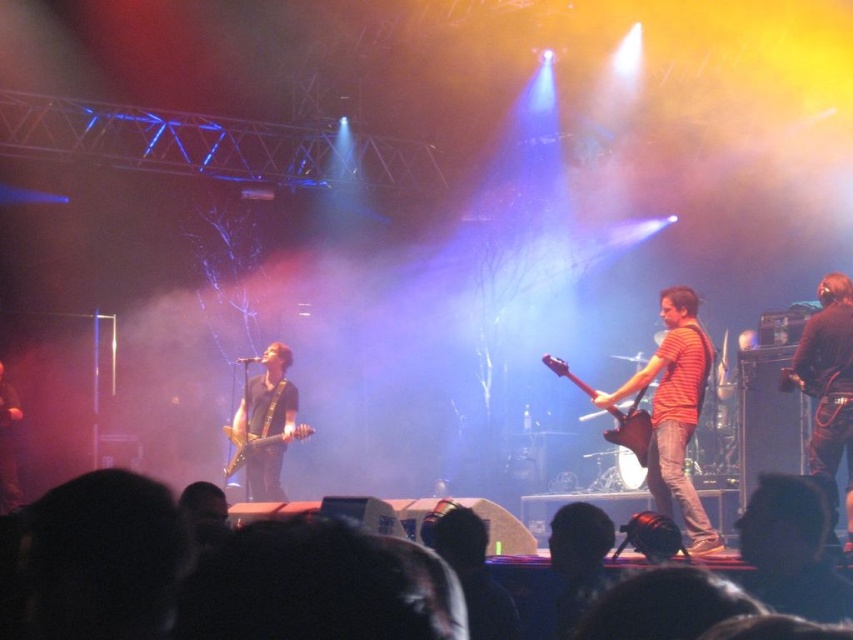
Between point (682, 310) and point (3, 499), which one is positioned in front?

Point (682, 310) is in front.

Between orange striped shirt at center and dark brown leather jacket at left, which one appears on the right side from the viewer's perspective?

From the viewer's perspective, orange striped shirt at center appears more on the right side.

What do you see at coordinates (674, 412) in the screenshot? The width and height of the screenshot is (853, 640). I see `orange striped shirt at center` at bounding box center [674, 412].

Where is `orange striped shirt at center`? This screenshot has height=640, width=853. orange striped shirt at center is located at coordinates (674, 412).

Who is positioned more to the left, matte black guitar at center or dark brown leather jacket at left?

dark brown leather jacket at left

Between point (248, 472) and point (12, 417), which one is positioned in front?

Point (248, 472) is more forward.

Is point (280, 376) in front of point (0, 490)?

Yes, point (280, 376) is in front of point (0, 490).

This screenshot has height=640, width=853. I want to click on matte black guitar at center, so pyautogui.click(x=265, y=422).

Can you confirm if orange striped shirt at center is positioned to the right of black leather jacket at right?

In fact, orange striped shirt at center is to the left of black leather jacket at right.

Who is higher up, orange striped shirt at center or black leather jacket at right?

black leather jacket at right is higher up.

Measure the distance between orange striped shirt at center and camera.

They are 5.52 meters apart.

This screenshot has height=640, width=853. I want to click on orange striped shirt at center, so click(674, 412).